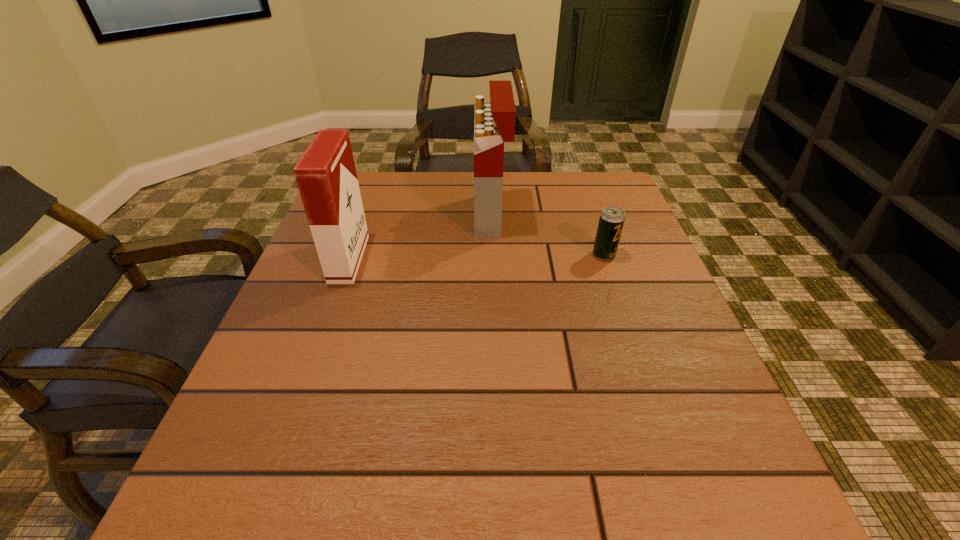
Find the location of `free space between the left cigarette_case and the shortest object`. free space between the left cigarette_case and the shortest object is located at coordinates (476, 257).

Find the location of `free spot between the rightmost object and the right cigarette_case`. free spot between the rightmost object and the right cigarette_case is located at coordinates (547, 235).

What are the coordinates of `free spot between the right cigarette_case and the leftmost object` in the screenshot? It's located at (420, 238).

What are the coordinates of `vacant space that's between the leftmost object and the right cigarette_case` in the screenshot? It's located at (420, 238).

Identify the location of vacant space that is in between the second object from right to left and the shortest object. The image size is (960, 540). (547, 235).

The width and height of the screenshot is (960, 540). I want to click on vacant area between the shortest object and the right cigarette_case, so click(547, 235).

Locate an element on the screen. vacant space in between the left cigarette_case and the second object from right to left is located at coordinates (420, 238).

Identify the location of vacant area that lies between the leftmost object and the rightmost object. (476, 257).

Find the location of a particular element. This screenshot has height=540, width=960. empty location between the second object from right to left and the beer can is located at coordinates (547, 235).

The width and height of the screenshot is (960, 540). Find the location of `object that is the second closest to the leftmost object`. object that is the second closest to the leftmost object is located at coordinates (611, 221).